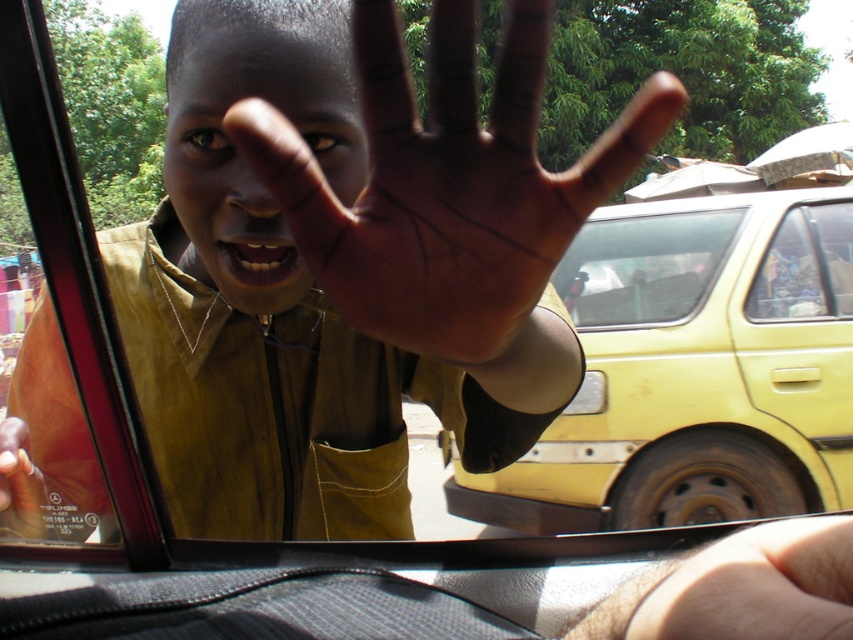
Question: Is yellow matte car at center positioned at the back of brown skin hand at center?

Choices:
 (A) no
 (B) yes

Answer: (B)

Question: Considering the real-world distances, which object is closest to the brown skin hand at center?

Choices:
 (A) dry skin at center
 (B) dark skin face at center
 (C) transparent plastic car window at center
 (D) yellow matte car window at center

Answer: (B)

Question: Does yellow matte car at center have a greater width compared to dark skin face at center?

Choices:
 (A) yes
 (B) no

Answer: (A)

Question: Among these points, which one is farthest from the camera?

Choices:
 (A) (505, 276)
 (B) (643, 410)

Answer: (B)

Question: Does yellow matte car at center have a smaller size compared to dark skin face at center?

Choices:
 (A) yes
 (B) no

Answer: (B)

Question: Among these objects, which one is farthest from the camera?

Choices:
 (A) yellow matte car at center
 (B) transparent plastic car window at center
 (C) dark skin face at center
 (D) brown skin hand at center

Answer: (B)